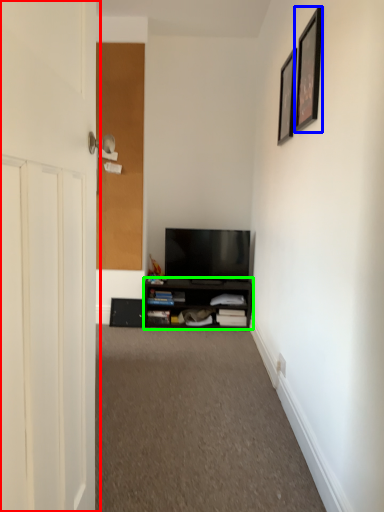
Question: Which is nearer to the door (highlighted by a red box)? picture frame (highlighted by a blue box) or cabinetry (highlighted by a green box).

Choices:
 (A) picture frame
 (B) cabinetry

Answer: (A)